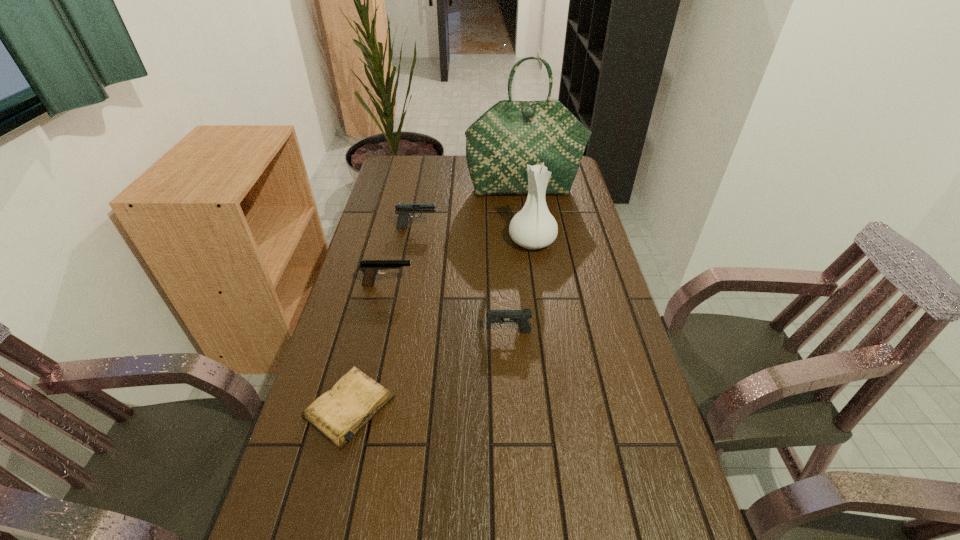
Find the location of a particular element. vase present at the right edge is located at coordinates (533, 227).

What are the coordinates of `object that is at the far right corner` in the screenshot? It's located at (510, 135).

Where is `free space at the left edge of the desktop`? The width and height of the screenshot is (960, 540). free space at the left edge of the desktop is located at coordinates (348, 309).

Where is `free region at the right edge`? The height and width of the screenshot is (540, 960). free region at the right edge is located at coordinates (563, 229).

At what (x,y) coordinates should I click in order to perform the action: click on blank space at the far left corner of the desktop. Please return your answer as a coordinate pair (x, y). Image resolution: width=960 pixels, height=540 pixels. Looking at the image, I should click on (412, 167).

Locate an element on the screen. This screenshot has height=540, width=960. free area in between the second tallest object and the rightmost pistol is located at coordinates (520, 287).

The height and width of the screenshot is (540, 960). Find the location of `free point between the fifth shortest object and the farthest pistol`. free point between the fifth shortest object and the farthest pistol is located at coordinates (474, 234).

Find the location of a particular element. The width and height of the screenshot is (960, 540). vacant region between the farthest pistol and the nearest pistol is located at coordinates (463, 279).

I want to click on vacant space in between the fourth farthest object and the tallest object, so click(456, 237).

Where is `empty space between the second nearest pistol and the fifth shortest object`? The width and height of the screenshot is (960, 540). empty space between the second nearest pistol and the fifth shortest object is located at coordinates (460, 263).